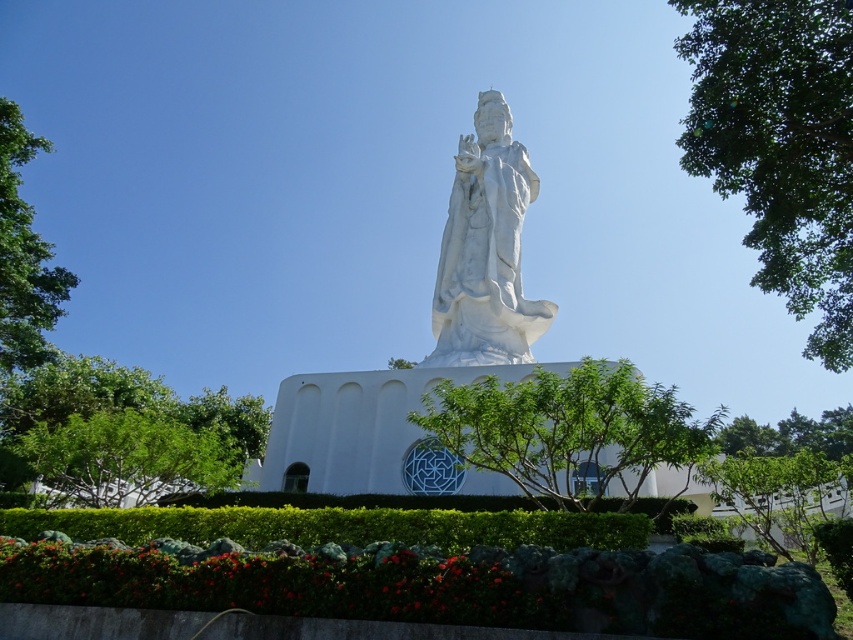
Question: Can you confirm if white marble statue at center is positioned to the right of green leafy tree at left?

Choices:
 (A) yes
 (B) no

Answer: (A)

Question: Among these objects, which one is farthest from the camera?

Choices:
 (A) green leafy tree at upper right
 (B) green leafy tree at left

Answer: (B)

Question: Is green leafy tree at center above green leafy tree at left?

Choices:
 (A) yes
 (B) no

Answer: (B)

Question: Based on their relative distances, which object is farther from the green leafy tree at center?

Choices:
 (A) green leafy tree at lower left
 (B) white marble statue at center

Answer: (A)

Question: Considering the real-world distances, which object is farthest from the green leafy tree at center?

Choices:
 (A) green leafy tree at left
 (B) green leafy tree at upper right

Answer: (A)

Question: In this image, where is white marble statue at center located relative to green leafy tree at left?

Choices:
 (A) above
 (B) below

Answer: (B)